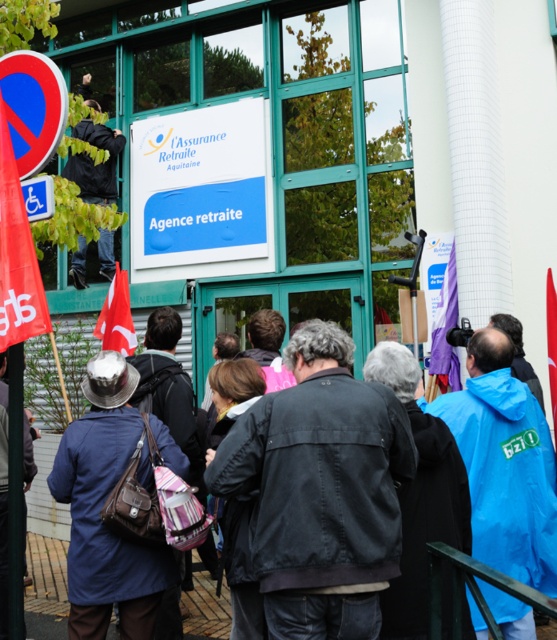
You are a visitor approaching the building and see the white plastic sign at upper center and the red fabric flag at lower left. Which object is located to the right of the other?

The white plastic sign at upper center is positioned on the right side of red fabric flag at lower right.

You are a photographer trying to capture a wide shot of the crowd outside the retirement agency. You notice the blue fabric coat at center and the purple fabric flag at center. Which object is wider in the image?

The blue fabric coat at center is wider than the purple fabric flag at center according to the description.